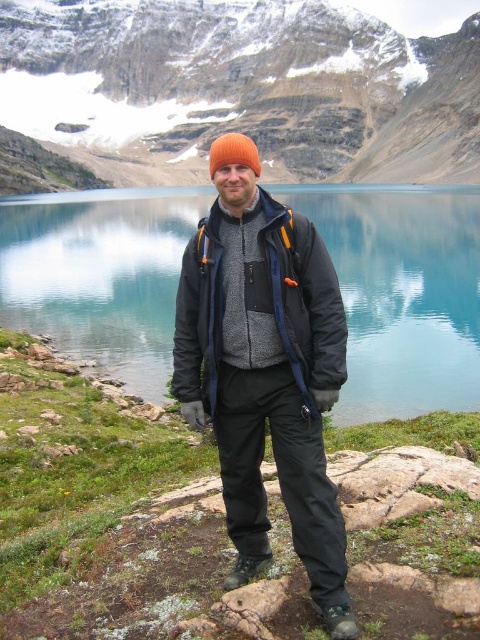
Is snowy rock mountain at upper center positioned at the back of orange knit hat at center?

That is True.

The image size is (480, 640). What are the coordinates of `snowy rock mountain at upper center` in the screenshot? It's located at (240, 88).

Is snowy rock mountain at upper center below matte black jacket at center?

No.

What do you see at coordinates (240, 88) in the screenshot?
I see `snowy rock mountain at upper center` at bounding box center [240, 88].

Is point (41, 125) farther from viewer compared to point (317, 340)?

Yes, point (41, 125) is farther from viewer.

You are a GUI agent. You are given a task and a screenshot of the screen. Output one action in this format:
    pyautogui.click(x=<x>, y=<y>)
    Task: Click on the snowy rock mountain at upper center
    
    Given the screenshot: What is the action you would take?
    pyautogui.click(x=240, y=88)

Is matte black jacket at center above brushed wool jacket at center?

No.

Is matte black jacket at center below brushed wool jacket at center?

Yes, matte black jacket at center is below brushed wool jacket at center.

Is point (278, 323) closer to camera compared to point (339, 314)?

No.

Locate an element on the screen. The width and height of the screenshot is (480, 640). matte black jacket at center is located at coordinates (265, 376).